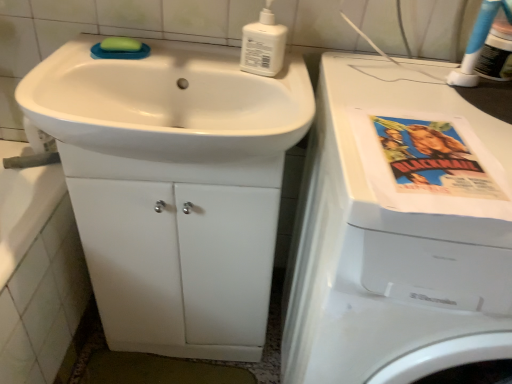
Locate an element on the screen. empty space that is ontop of white plastic washing machine at right (from a real-world perspective) is located at coordinates (444, 121).